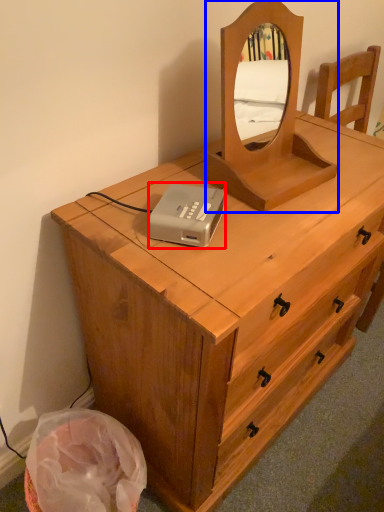
Question: Which of the following is the closest to the observer, cassette (highlighted by a red box) or mirror (highlighted by a blue box)?

Choices:
 (A) cassette
 (B) mirror

Answer: (B)